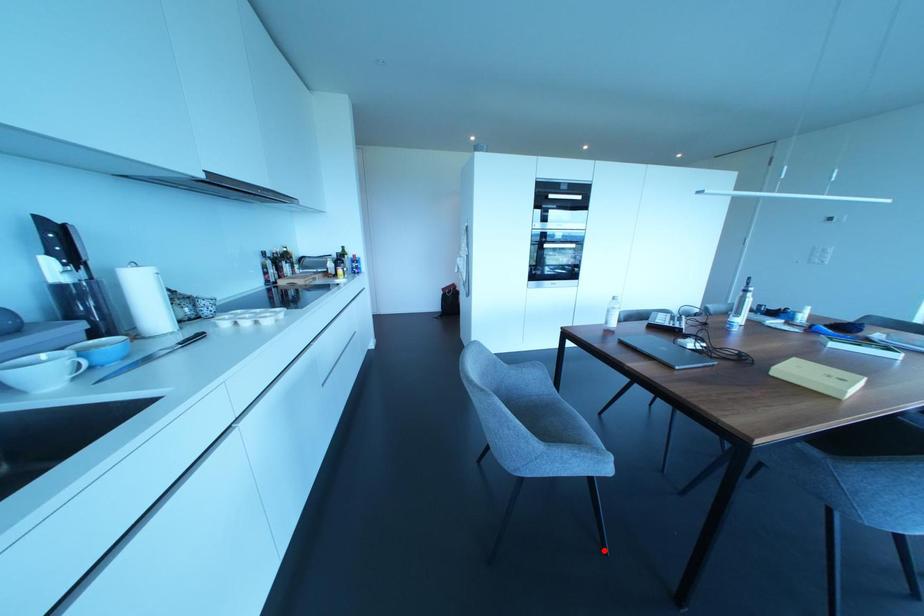
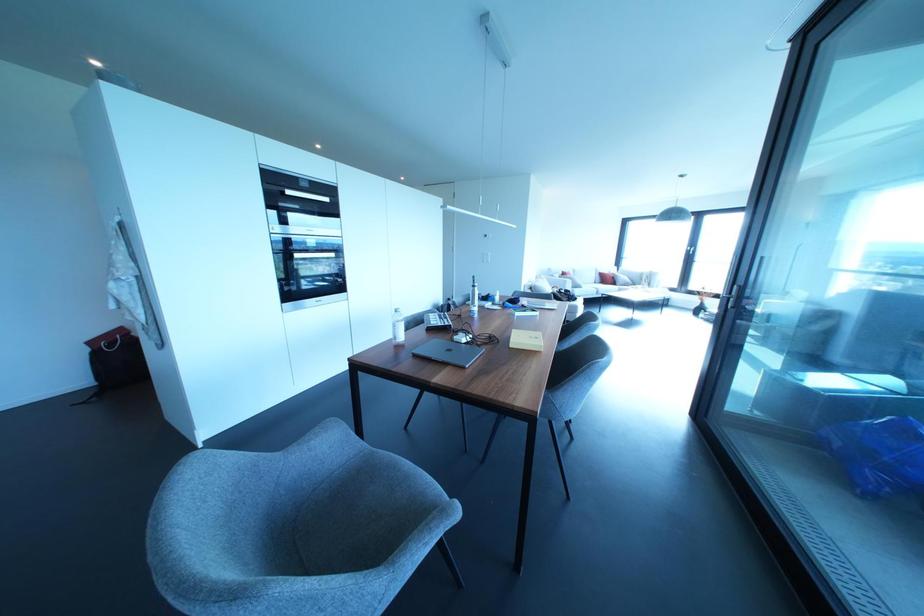
Find the pixel in the second image that matches the highlighted location in the first image.

(458, 585)